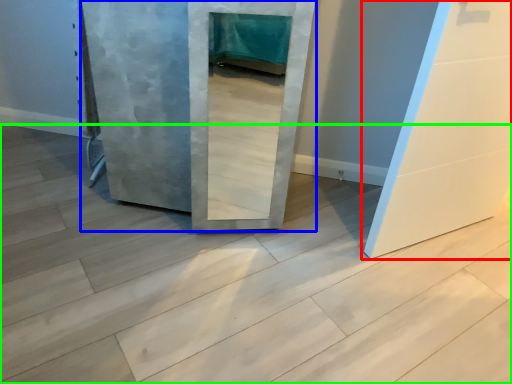
Question: Based on their relative distances, which object is farther from door (highlighted by a red box)? Choose from door (highlighted by a blue box) and concrete (highlighted by a green box).

Choices:
 (A) door
 (B) concrete

Answer: (A)